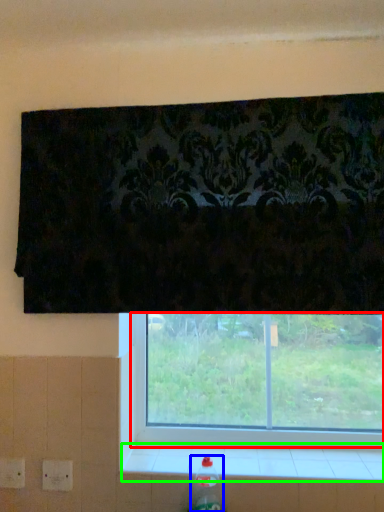
Question: Based on their relative distances, which object is nearer to window (highlighted by a red box)? Choose from bottle (highlighted by a blue box) and window sill (highlighted by a green box).

Choices:
 (A) bottle
 (B) window sill

Answer: (B)